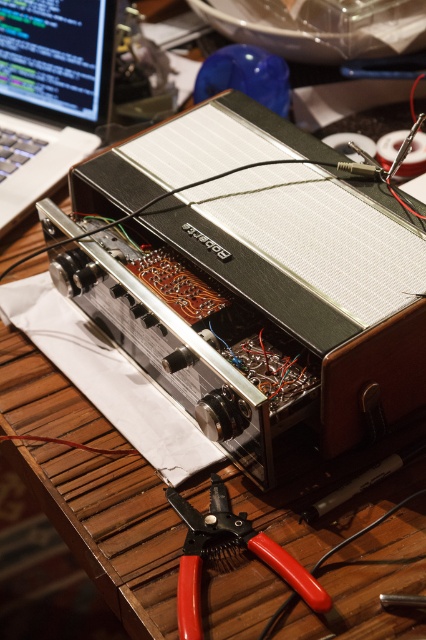
You are working on repairing the vintage Roberts amplifier and need to access your tools and laptop. From your current viewpoint, which object is positioned to the right side between the matte black laptop at upper left and the red plastic pliers at lower center?

The red plastic pliers at lower center is positioned to the right of the matte black laptop at upper left.

You are a technician working on the amplifier. You need to place the red plastic pliers at lower center somewhere on the metallic silver amplifier at center. Is there enough vertical space to do so?

The metallic silver amplifier at center has a greater height compared to red plastic pliers at lower center, so yes, there is enough vertical space to place the red plastic pliers at lower center on the amplifier.

You are working on repairing the vintage Roberts amplifier and need to place both the matte black laptop at upper left and the red plastic pliers at lower center on a shelf. The shelf has a maximum width of 50 cm. Given their sizes, will both items fit side by side?

The matte black laptop at upper left is wider than the red plastic pliers at lower center. However, without knowing their exact widths or the total combined width, it is impossible to determine if they will fit on the 50 cm shelf.